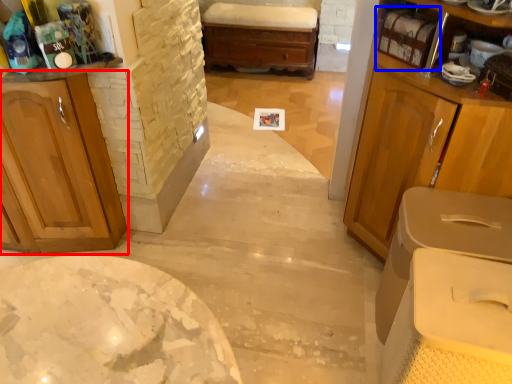
Question: Which object appears closest to the camera in this image, cabinetry (highlighted by a red box) or shelf (highlighted by a blue box)?

Choices:
 (A) cabinetry
 (B) shelf

Answer: (A)